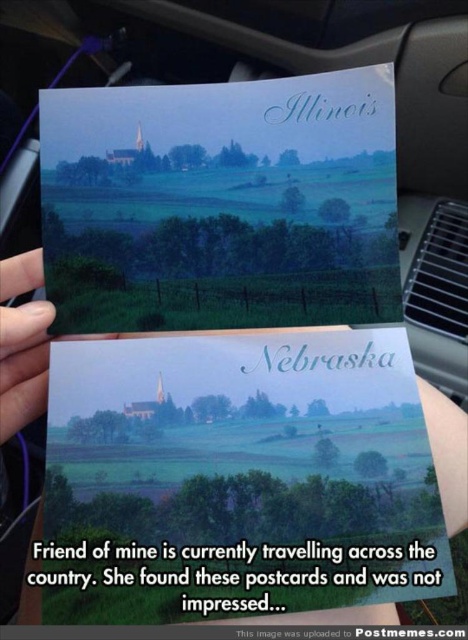
Consider the image. You are a photographer trying to capture the white paper at center and the matte black finger at lower left in focus. Which object should you adjust your camera focus to prioritize to ensure both are sharp?

The white paper at center is in front of the matte black finger at lower left. To ensure both are in focus, prioritize focusing on the matte black finger at lower left since it is farther away, allowing the depth of field to cover the closer white paper at center.

You are designing a display for a travel agency. You have two items to place on a shelf. The matte paper postcard at upper center and the white paper at center. The shelf can only hold items that are at least 5 inches apart. Can you place both items on the shelf?

The matte paper postcard at upper center and white paper at center are 6.09 inches apart from each other, which is more than the required 5 inches. Therefore, they can be placed on the shelf.

Based on the photo, you are a graphic designer evaluating the layout of a promotional material. You notice the white paper at center and the matte black finger at lower left in the design. Which element has a greater width?

The white paper at center has a greater width than the matte black finger at lower left according to the description.